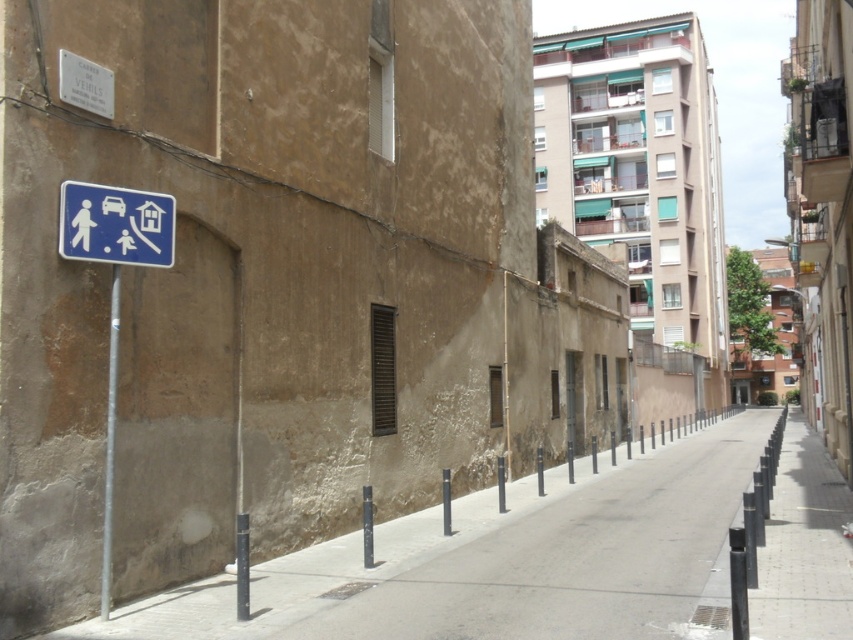
Question: Considering the relative positions of blue plastic sign at upper left and metallic pole at left in the image provided, where is blue plastic sign at upper left located with respect to metallic pole at left?

Choices:
 (A) above
 (B) below

Answer: (A)

Question: Is blue plastic sign at upper left wider than metallic pole at left?

Choices:
 (A) no
 (B) yes

Answer: (B)

Question: Which point is farther to the camera?

Choices:
 (A) metallic pole at left
 (B) blue plastic sign at upper left

Answer: (A)

Question: Which object appears closest to the camera in this image?

Choices:
 (A) blue plastic sign at upper left
 (B) metallic pole at left

Answer: (A)

Question: Which point appears farthest from the camera in this image?

Choices:
 (A) (108, 540)
 (B) (167, 250)

Answer: (B)

Question: Can you confirm if blue plastic sign at upper left is positioned to the left of metallic pole at left?

Choices:
 (A) yes
 (B) no

Answer: (B)